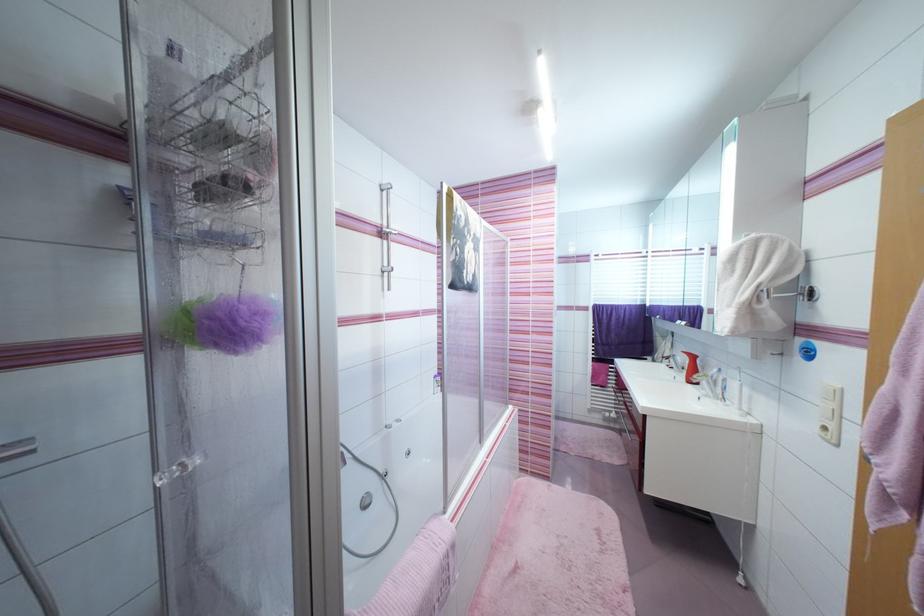
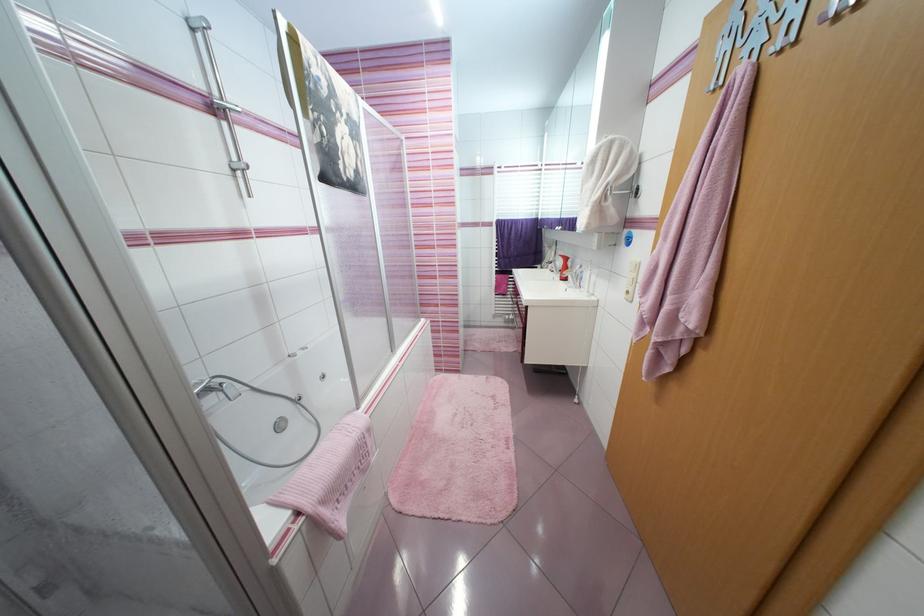
In the second image, find the point that corresponds to (x=371, y=504) in the first image.

(286, 428)